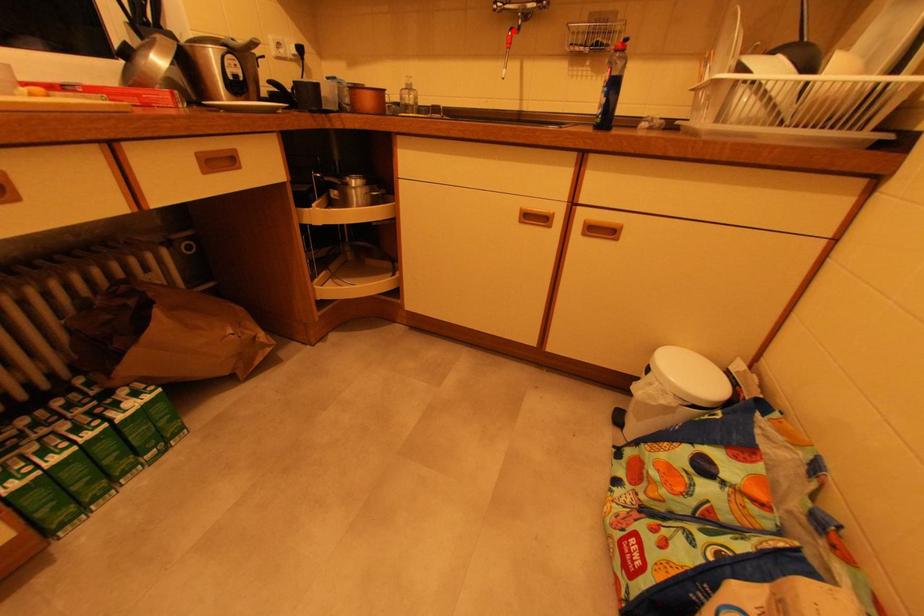
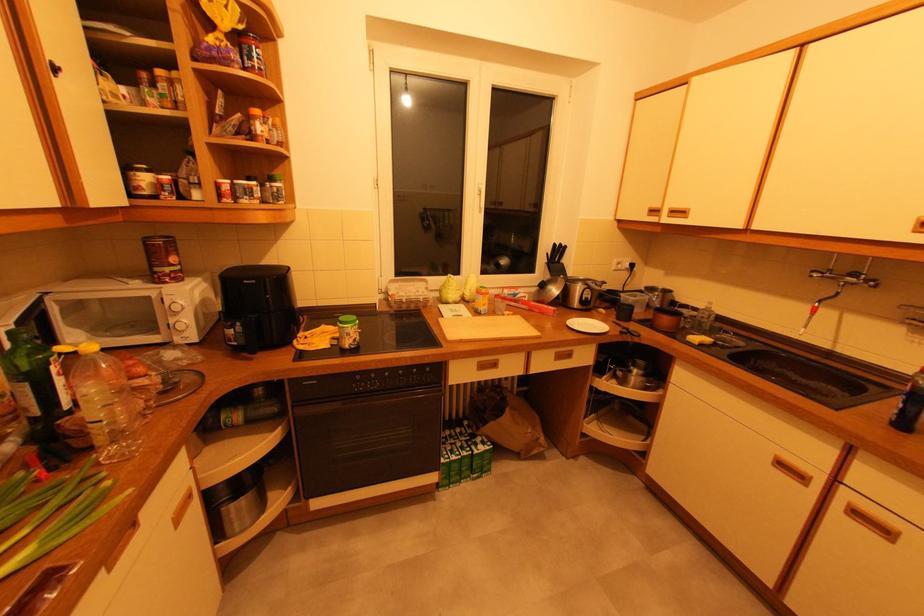
The point at the highlighted location is marked in the first image. Where is the corresponding point in the second image?

(822, 302)